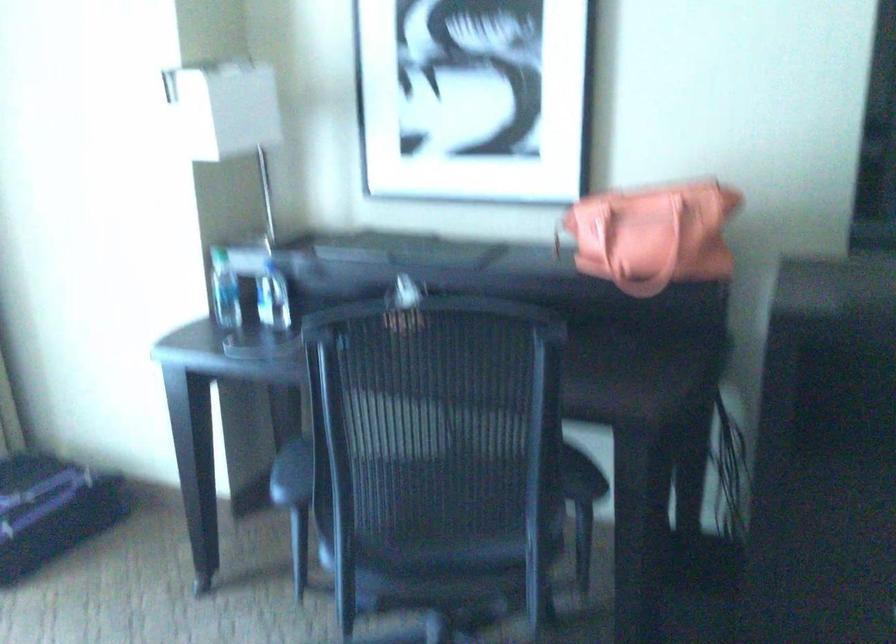
Image resolution: width=896 pixels, height=644 pixels. What do you see at coordinates (291, 474) in the screenshot? I see `the chair armrest` at bounding box center [291, 474].